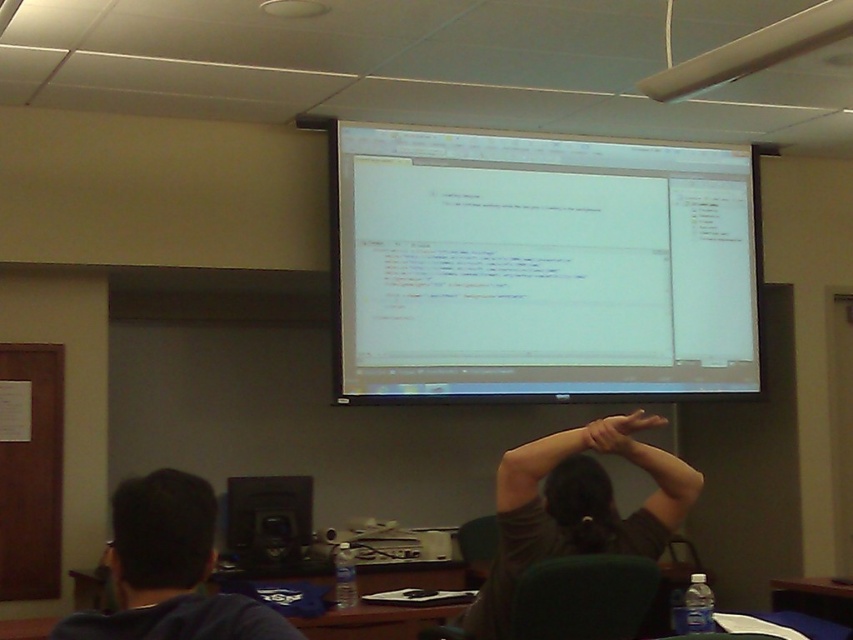
Question: Among these points, which one is farthest from the camera?

Choices:
 (A) (645, 428)
 (B) (503, 516)
 (C) (296, 561)
 (D) (567, 257)

Answer: (D)

Question: Which of these objects is positioned closest to the white glossy projection screen at upper center?

Choices:
 (A) black plastic speaker at lower center
 (B) dark blue hoodie at lower left

Answer: (A)

Question: Is white glossy projection screen at upper center positioned in front of dark blue hoodie at lower left?

Choices:
 (A) no
 (B) yes

Answer: (A)

Question: Which object is farther from the camera taking this photo?

Choices:
 (A) dark brown shirt at upper center
 (B) white glossy projection screen at upper center
 (C) black plastic speaker at lower center
 (D) dark blue hoodie at lower left

Answer: (C)

Question: Is the position of white glossy projection screen at upper center less distant than that of black plastic speaker at lower center?

Choices:
 (A) yes
 (B) no

Answer: (A)

Question: Is dark brown shirt at upper center to the right of dark blue hoodie at lower left from the viewer's perspective?

Choices:
 (A) yes
 (B) no

Answer: (A)